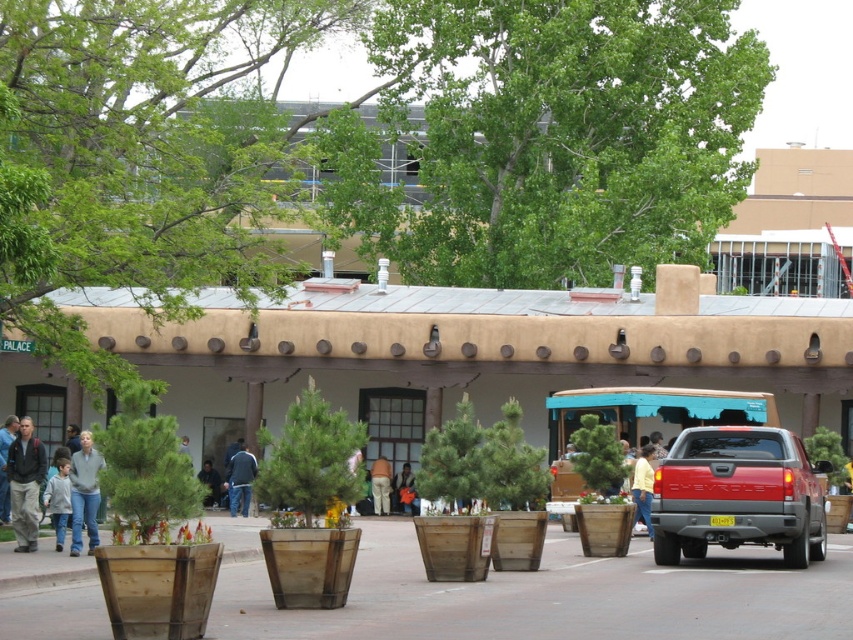
You are a photographer taking a picture of the yellow cotton shirt at center and the light brown pants at center. Which one should you focus on if you want to capture the taller object in the scene?

The yellow cotton shirt at center is taller than the light brown pants at center, so you should focus on the yellow cotton shirt at center to capture the taller object.

You are a delivery person who needs to load a large package into either the red matte truck at center right or the orange fabric bag at center. Based on their sizes, which one can accommodate the package better?

The red matte truck at center right is bigger than the orange fabric bag at center, so it can accommodate the large package better.

You are standing in front of the building and see the red matte truck at center right and the orange fabric bag at center. Which object is closer to you?

The red matte truck at center right is closer to the viewer than the orange fabric bag at center.